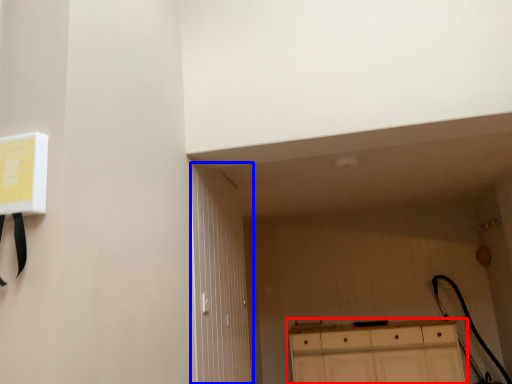
Question: Which object appears farthest to the camera in this image, cabinetry (highlighted by a red box) or door (highlighted by a blue box)?

Choices:
 (A) cabinetry
 (B) door

Answer: (A)